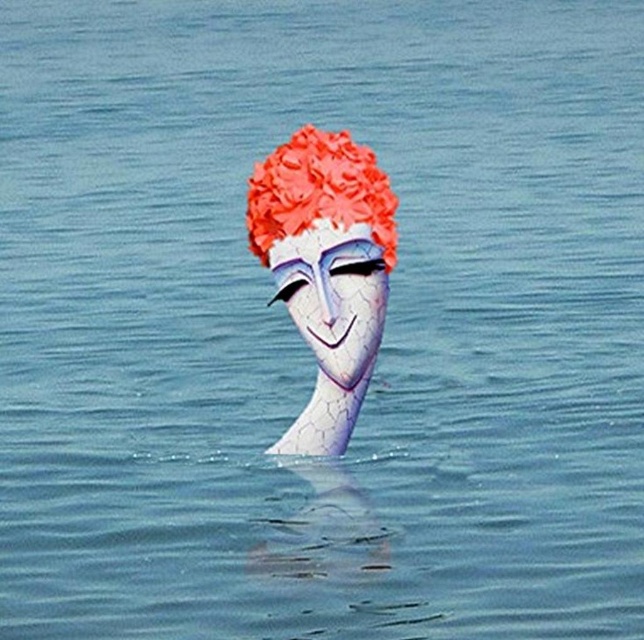
Question: Does cracked porcelain mask at center come behind shiny orange hair at center?

Choices:
 (A) yes
 (B) no

Answer: (A)

Question: Among these points, which one is farthest from the camera?

Choices:
 (A) (319, 356)
 (B) (279, 252)
 (C) (285, 173)

Answer: (A)

Question: Which object appears closest to the camera in this image?

Choices:
 (A) cracked porcelain mask at center
 (B) shiny orange hair at center

Answer: (B)

Question: Is cracked porcelain head at center below shiny orange hair at center?

Choices:
 (A) yes
 (B) no

Answer: (A)

Question: Which of the following is the farthest from the observer?

Choices:
 (A) cracked porcelain mask at center
 (B) cracked porcelain head at center

Answer: (A)

Question: Is cracked porcelain mask at center thinner than shiny orange hair at center?

Choices:
 (A) yes
 (B) no

Answer: (A)